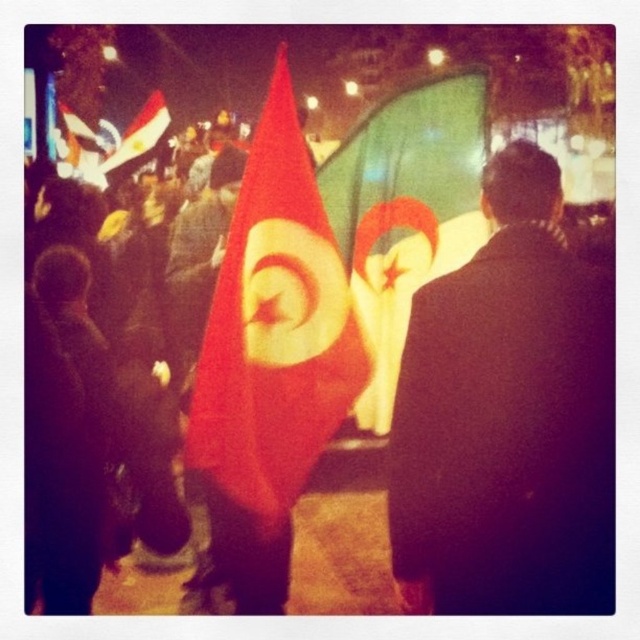
Question: Which of these objects is positioned closest to the dark wool coat at center?

Choices:
 (A) green fabric flag at center
 (B) red fabric flag at center
 (C) matte red flag at upper left
 (D) smooth skin face at center

Answer: (B)

Question: Which object is closer to the camera taking this photo?

Choices:
 (A) matte red flag at upper left
 (B) smooth skin face at center
 (C) red fabric flag at center

Answer: (C)

Question: In this image, where is red fabric flag at center located relative to smooth skin face at center?

Choices:
 (A) right
 (B) left

Answer: (A)

Question: Which object is farther from the camera taking this photo?

Choices:
 (A) red fabric flag at center
 (B) matte red flag at upper left

Answer: (B)

Question: Is green fabric flag at center smaller than smooth skin face at center?

Choices:
 (A) no
 (B) yes

Answer: (A)

Question: Does dark wool coat at center lie behind red fabric flag at center?

Choices:
 (A) no
 (B) yes

Answer: (A)